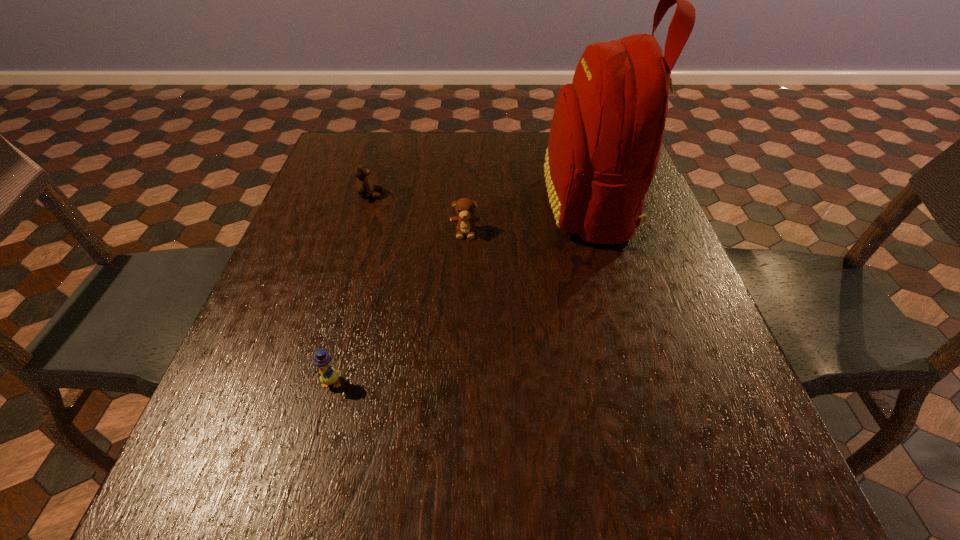
Select which object is the third closest to the backpack. Please provide its 2D coordinates. Your answer should be formatted as a tuple, i.e. [(x, y)], where the tuple contains the x and y coordinates of a point satisfying the conditions above.

[(329, 376)]

Point out which object is positioned as the third nearest to the farther teddy bear. Please provide its 2D coordinates. Your answer should be formatted as a tuple, i.e. [(x, y)], where the tuple contains the x and y coordinates of a point satisfying the conditions above.

[(329, 376)]

Image resolution: width=960 pixels, height=540 pixels. Find the location of `vacant space that satisfies the following two spatial constraints: 1. on the front-facing side of the rightmost object; 2. on the face of the nearest object, where the monocle is placed`. vacant space that satisfies the following two spatial constraints: 1. on the front-facing side of the rightmost object; 2. on the face of the nearest object, where the monocle is placed is located at coordinates (638, 382).